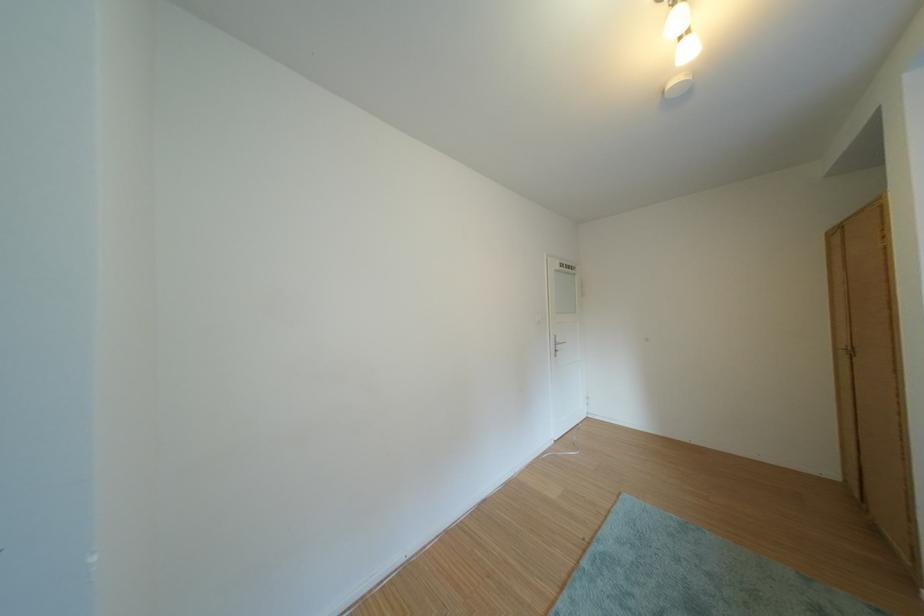
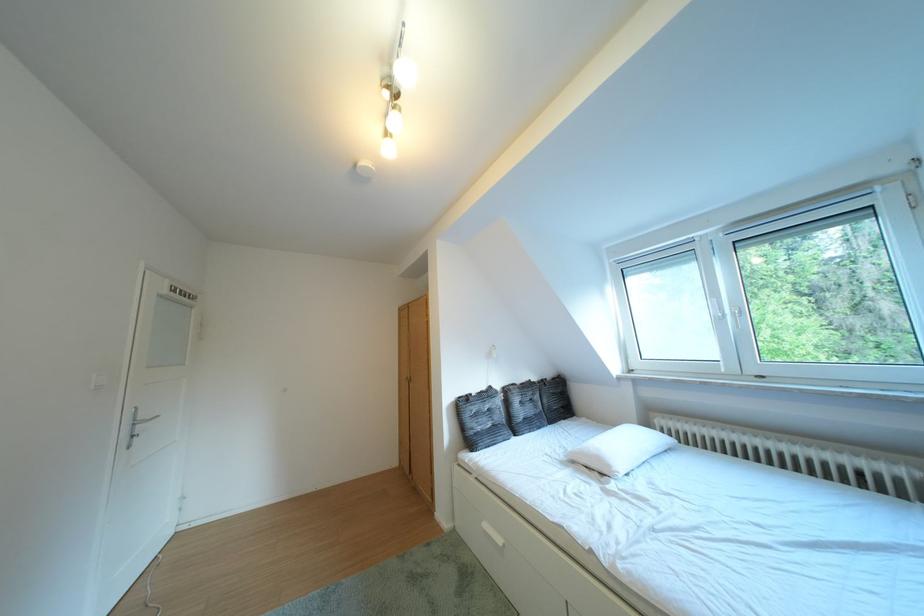
Find the pixel in the second image that matches pixel 565 342 in the first image.

(141, 418)